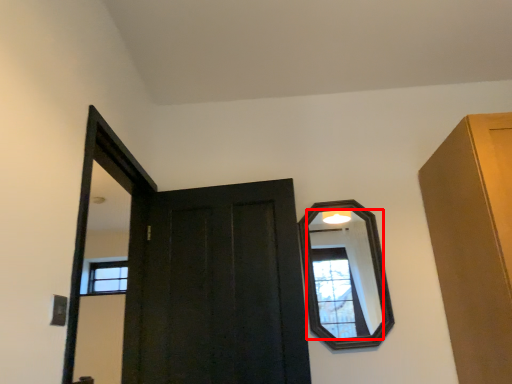
Question: From the image's perspective, what is the correct spatial positioning of mirror (annotated by the red box) in reference to door?

Choices:
 (A) above
 (B) below

Answer: (A)